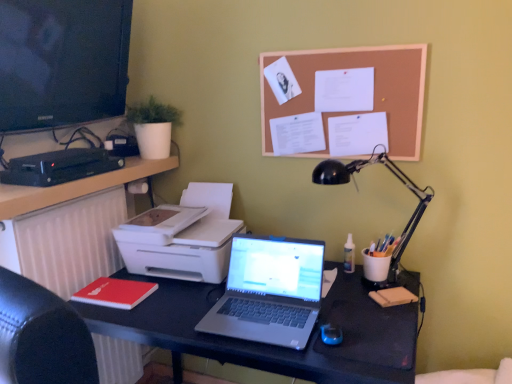
What do you see at coordinates (115, 293) in the screenshot?
I see `red matte notepad at lower left` at bounding box center [115, 293].

In order to click on black matte desk at center in this screenshot , I will do `click(271, 345)`.

What do you see at coordinates (66, 242) in the screenshot? This screenshot has width=512, height=384. I see `white matte radiator at left` at bounding box center [66, 242].

Image resolution: width=512 pixels, height=384 pixels. What do you see at coordinates (183, 236) in the screenshot?
I see `white plastic printer at left` at bounding box center [183, 236].

What is the approximate height of corkboard at upper center?

corkboard at upper center is 15.64 inches tall.

Find the location of a particular element. The height and width of the screenshot is (384, 512). black metal desk lamp at right is located at coordinates (399, 180).

This screenshot has height=384, width=512. Describe the element at coordinates (62, 62) in the screenshot. I see `black glossy screen at upper left` at that location.

Image resolution: width=512 pixels, height=384 pixels. Find the location of `red matte notepad at lower left`. red matte notepad at lower left is located at coordinates (115, 293).

Find the location of a particular element. This screenshot has width=512, height=384. desk below the black glossy screen at upper left (from a real-world perspective) is located at coordinates (271, 345).

From a real-world perspective, is black glossy screen at upper left above or below black matte desk at center?

black glossy screen at upper left is above black matte desk at center.

Looking at this image, is black glossy screen at upper left looking in the opposite direction of black matte desk at center?

No, black matte desk at center is not at the back of black glossy screen at upper left.

Can you confirm if black glossy screen at upper left is wider than black matte desk at center?

No.

Which is closer to the camera, (12, 127) or (80, 159)?

Positioned in front is point (12, 127).

Is black glossy screen at upper left next to black plastic dvd player at left and touching it?

No, black glossy screen at upper left is not touching black plastic dvd player at left.

Is black glossy screen at upper left not within black plastic dvd player at left?

Indeed, black glossy screen at upper left is completely outside black plastic dvd player at left.

In the scene shown: Does black glossy screen at upper left turn towards black plastic dvd player at left?

No, black glossy screen at upper left does not turn towards black plastic dvd player at left.

Is white plastic printer at left turned away from black plastic dvd player at left?

No, white plastic printer at left is not facing away from black plastic dvd player at left.

Between white plastic printer at left and black plastic dvd player at left, which one has smaller width?

black plastic dvd player at left is thinner.

From a real-world perspective, which object stands above the other?

black plastic dvd player at left, from a real-world perspective.

Can you confirm if white plastic printer at left is bigger than black plastic dvd player at left?

Yes, white plastic printer at left is bigger than black plastic dvd player at left.

Measure the distance from black matte desk at center to corkboard at upper center.

The distance of black matte desk at center from corkboard at upper center is 27.02 inches.

Would you consider black matte desk at center to be distant from corkboard at upper center?

No, there isn't a large distance between black matte desk at center and corkboard at upper center.

Is black matte desk at center situated inside corkboard at upper center or outside?

black matte desk at center is located beyond the bounds of corkboard at upper center.

Is black matte desk at center to the left of corkboard at upper center from the viewer's perspective?

Yes, black matte desk at center is to the left of corkboard at upper center.

Can you see corkboard at upper center touching black metal desk lamp at right?

No, corkboard at upper center is not making contact with black metal desk lamp at right.

Is corkboard at upper center shorter than black metal desk lamp at right?

Yes.

From the image's perspective, is corkboard at upper center on top of black metal desk lamp at right?

Yes, from the image's perspective, corkboard at upper center is on top of black metal desk lamp at right.

Is black metal desk lamp at right situated inside silver metallic laptop at center or outside?

black metal desk lamp at right is spatially situated outside silver metallic laptop at center.

From the image's perspective, would you say black metal desk lamp at right is positioned over silver metallic laptop at center?

Yes, from the image's perspective, black metal desk lamp at right is on top of silver metallic laptop at center.

Considering the relative sizes of black metal desk lamp at right and silver metallic laptop at center in the image provided, is black metal desk lamp at right smaller than silver metallic laptop at center?

Incorrect, black metal desk lamp at right is not smaller in size than silver metallic laptop at center.

What's the angular difference between black metal desk lamp at right and silver metallic laptop at center's facing directions?

1.82 degrees.

Could you tell me if black plastic dvd player at left is facing silver metallic laptop at center?

No, black plastic dvd player at left is not facing towards silver metallic laptop at center.

Can you confirm if black plastic dvd player at left is shorter than silver metallic laptop at center?

Indeed, black plastic dvd player at left has a lesser height compared to silver metallic laptop at center.

From the image's perspective, is black plastic dvd player at left located above silver metallic laptop at center?

Result: Yes.

Which of these two, black plastic dvd player at left or silver metallic laptop at center, is bigger?

Bigger between the two is silver metallic laptop at center.

Where is `television lying above the black matte desk at center (from the image's perspective)`? This screenshot has width=512, height=384. television lying above the black matte desk at center (from the image's perspective) is located at coordinates (62, 62).

I want to click on stationery below the black glossy screen at upper left (from the image's perspective), so click(x=59, y=167).

Which object lies further to the anchor point silver metallic laptop at center, black glossy screen at upper left or black matte desk at center?

black glossy screen at upper left is positioned further to the anchor silver metallic laptop at center.

From the image, which object appears to be farther from red matte notepad at lower left, silver metallic laptop at center or black plastic dvd player at left?

Based on the image, black plastic dvd player at left appears to be further to red matte notepad at lower left.

When comparing their distances from corkboard at upper center, does white matte radiator at left or black plastic dvd player at left seem closer?

black plastic dvd player at left is closer to corkboard at upper center.

Which object lies further to the anchor point white matte radiator at left, red matte notepad at lower left or corkboard at upper center?

The object further to white matte radiator at left is corkboard at upper center.

Looking at the image, which one is located closer to black plastic dvd player at left, silver metallic laptop at center or black matte desk at center?

The object closer to black plastic dvd player at left is black matte desk at center.

Based on their spatial positions, is black matte desk at center or corkboard at upper center further from white plastic printer at left?

corkboard at upper center is positioned further to the anchor white plastic printer at left.

From the image, which object appears to be farther from black matte desk at center, black metal desk lamp at right or silver metallic laptop at center?

Result: black metal desk lamp at right is further to black matte desk at center.

Which object lies nearer to the anchor point silver metallic laptop at center, red matte notepad at lower left or black plastic dvd player at left?

red matte notepad at lower left is positioned closer to the anchor silver metallic laptop at center.

At what (x,y) coordinates should I click in order to perform the action: click on television between white matte radiator at left and black metal desk lamp at right from left to right. Please return your answer as a coordinate pair (x, y). This screenshot has width=512, height=384. Looking at the image, I should click on (62, 62).

Identify the location of notepad between white matte radiator at left and black metal desk lamp at right from left to right. (115, 293).

At what (x,y) coordinates should I click in order to perform the action: click on laptop between black glossy screen at upper left and black matte desk at center vertically. Please return your answer as a coordinate pair (x, y). Image resolution: width=512 pixels, height=384 pixels. Looking at the image, I should click on (269, 291).

Where is `printer situated between red matte notepad at lower left and corkboard at upper center from left to right`? This screenshot has height=384, width=512. printer situated between red matte notepad at lower left and corkboard at upper center from left to right is located at coordinates (183, 236).